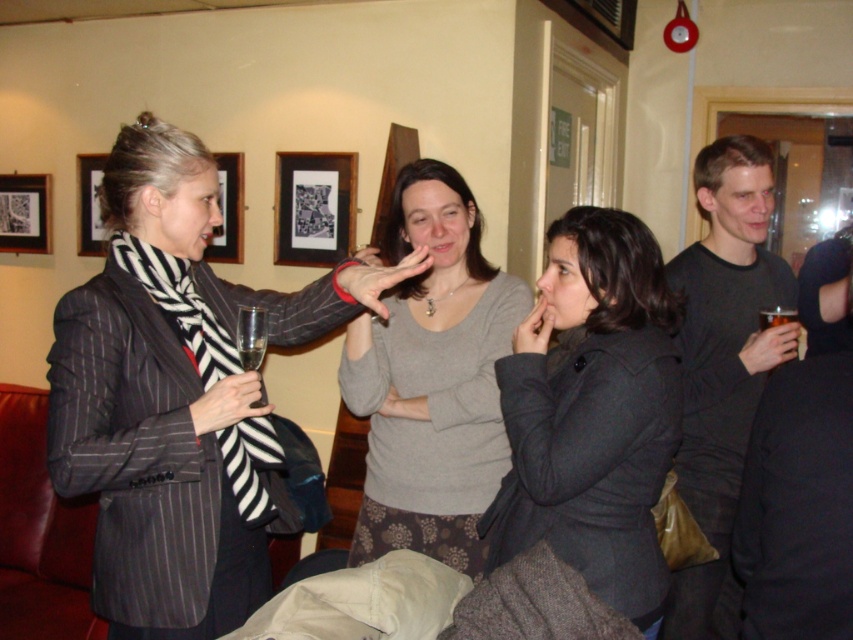
Does dark gray wool coat at center have a greater width compared to black matte shirt at right?

No, dark gray wool coat at center is not wider than black matte shirt at right.

Who is positioned more to the left, dark gray wool coat at center or black matte shirt at right?

Positioned to the left is dark gray wool coat at center.

Locate an element on the screen. The height and width of the screenshot is (640, 853). dark gray wool coat at center is located at coordinates (592, 412).

I want to click on dark gray wool coat at center, so pos(592,412).

Does matte black picture frame at upper left have a greater width compared to translucent glass at upper right?

Yes, matte black picture frame at upper left is wider than translucent glass at upper right.

Measure the distance between matte black picture frame at upper left and translucent glass at upper right.

10.43 feet

The width and height of the screenshot is (853, 640). Identify the location of matte black picture frame at upper left. (24, 212).

Locate an element on the screen. matte black picture frame at upper left is located at coordinates (24, 212).

Can you confirm if dark gray wool coat at center is positioned to the left of gray sweater at center?

No, dark gray wool coat at center is not to the left of gray sweater at center.

Who is positioned more to the left, dark gray wool coat at center or gray sweater at center?

gray sweater at center is more to the left.

The height and width of the screenshot is (640, 853). Describe the element at coordinates (592, 412) in the screenshot. I see `dark gray wool coat at center` at that location.

The width and height of the screenshot is (853, 640). I want to click on dark gray wool coat at center, so click(592, 412).